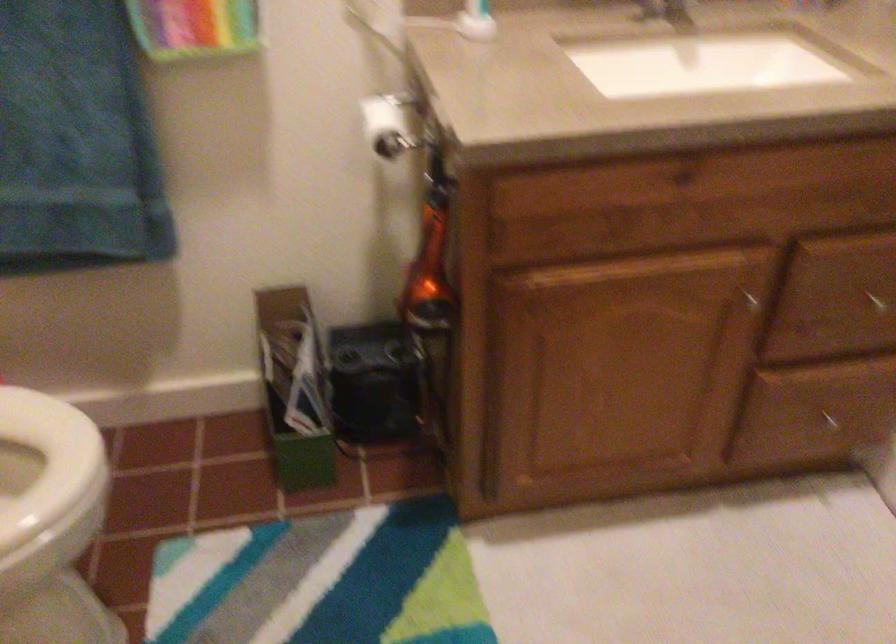
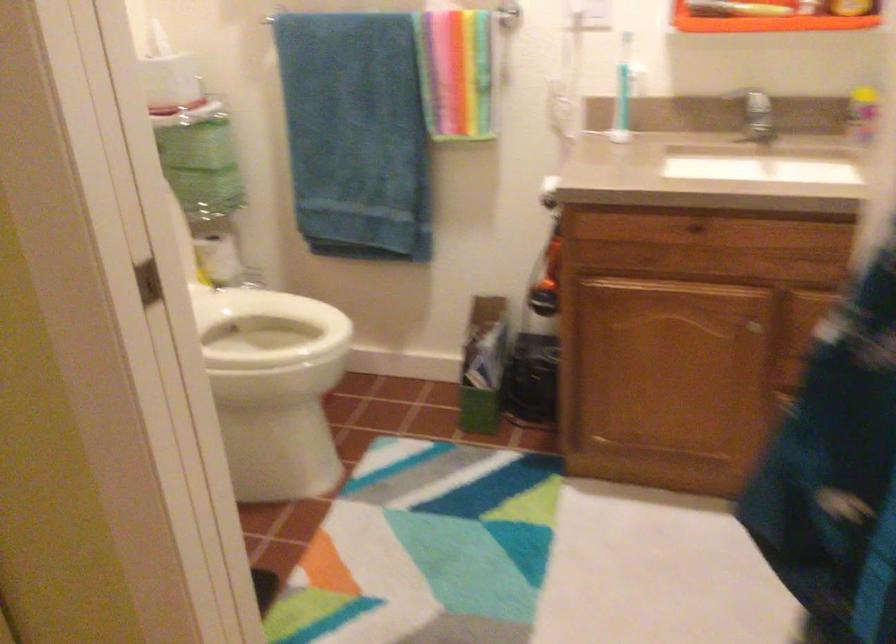
Question: How did the camera likely rotate?

Choices:
 (A) Left
 (B) Right
 (C) Up
 (D) Down

Answer: (A)